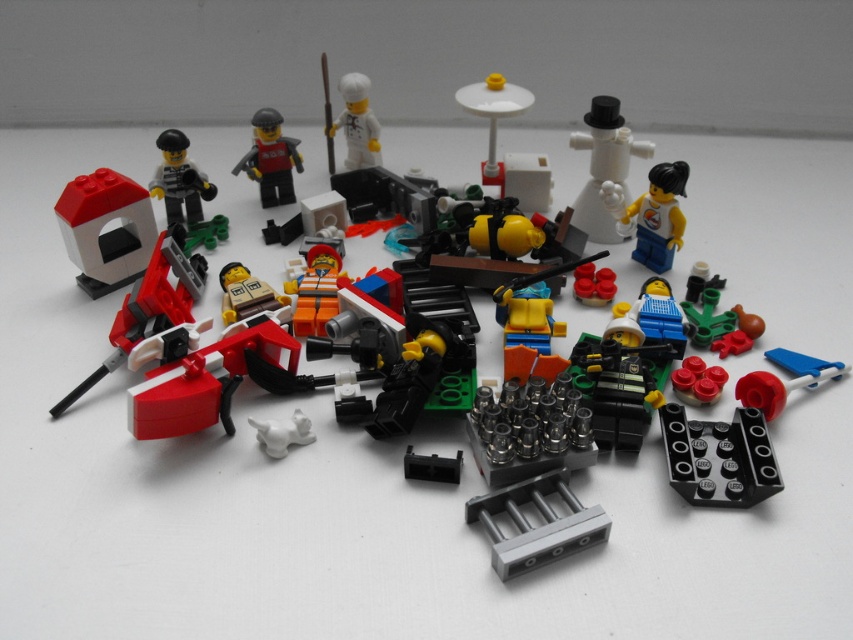
Between white glossy minifigure at upper right and matte black minifigure at upper left, which one appears on the right side from the viewer's perspective?

white glossy minifigure at upper right is more to the right.

Is point (608, 184) farther from camera compared to point (183, 188)?

That is False.

Between point (669, 170) and point (196, 188), which one is positioned in front?

Point (669, 170) is more forward.

I want to click on white glossy minifigure at upper right, so click(x=653, y=214).

Is point (708, 435) in front of point (137, 189)?

Yes, it is.

Where is `black plastic plate at lower right`? This screenshot has width=853, height=640. black plastic plate at lower right is located at coordinates (718, 458).

Locate an element on the screen. black plastic plate at lower right is located at coordinates (718, 458).

Who is positioned more to the right, matte red house at left or white matte chef hat at upper center?

white matte chef hat at upper center

Is matte red house at left smaller than white matte chef hat at upper center?

Incorrect, matte red house at left is not smaller in size than white matte chef hat at upper center.

At what (x,y) coordinates should I click in order to perform the action: click on matte red house at left. Please return your answer as a coordinate pair (x, y). The height and width of the screenshot is (640, 853). Looking at the image, I should click on (105, 230).